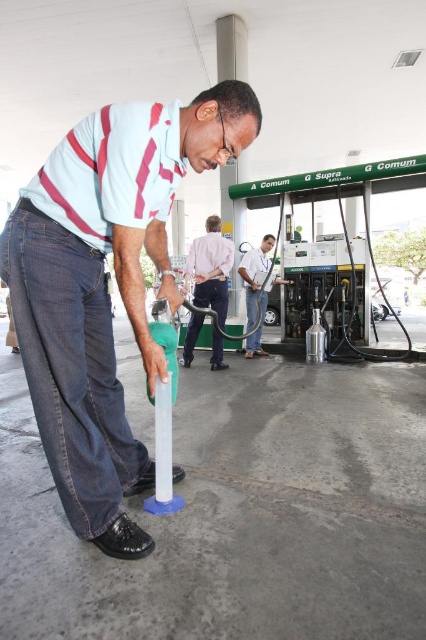
Question: Based on their relative distances, which object is nearer to the pink cotton shirt at center?

Choices:
 (A) matte plastic pump handle at center
 (B) white glossy fuel nozzle at center

Answer: (B)

Question: From the image, what is the correct spatial relationship of matte plastic pump handle at center in relation to pink cotton shirt at center?

Choices:
 (A) right
 (B) left

Answer: (B)

Question: Is matte plastic pump handle at center wider than white glossy fuel nozzle at center?

Choices:
 (A) no
 (B) yes

Answer: (B)

Question: Which point is farther to the camera?

Choices:
 (A) white glossy fuel nozzle at center
 (B) matte plastic pump handle at center

Answer: (A)

Question: Does pink cotton shirt at center have a greater width compared to white glossy fuel nozzle at center?

Choices:
 (A) yes
 (B) no

Answer: (B)

Question: Which object is closer to the camera taking this photo?

Choices:
 (A) matte plastic pump handle at center
 (B) pink cotton shirt at center
 (C) white glossy fuel nozzle at center

Answer: (A)